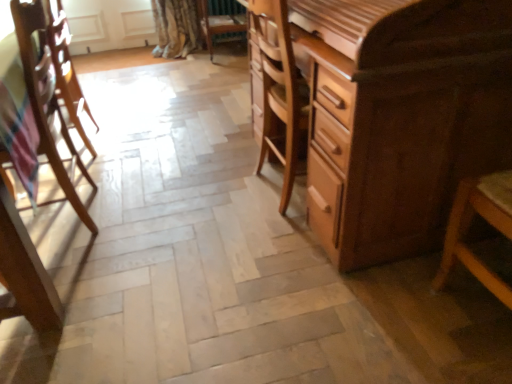
Question: Should I look upward or downward to see shiny brown wooden chest of drawers at right?

Choices:
 (A) down
 (B) up

Answer: (B)

Question: From the image's perspective, is wooden chair at center, positioned as the first chair in back-to-front order, under shiny brown wooden chest of drawers at right?

Choices:
 (A) no
 (B) yes

Answer: (A)

Question: From a real-world perspective, is wooden chair at center, placed as the 1th chair when sorted from right to left, physically below shiny brown wooden chest of drawers at right?

Choices:
 (A) yes
 (B) no

Answer: (A)

Question: Is the depth of wooden chair at center, placed as the 1th chair when sorted from right to left, greater than that of shiny brown wooden chest of drawers at right?

Choices:
 (A) no
 (B) yes

Answer: (B)

Question: Would you say wooden chair at center, the first chair when ordered from top to bottom, contains shiny brown wooden chest of drawers at right?

Choices:
 (A) no
 (B) yes

Answer: (A)

Question: Is wooden chair at center, which appears as the second chair when viewed from the left, outside shiny brown wooden chest of drawers at right?

Choices:
 (A) yes
 (B) no

Answer: (A)

Question: Can you confirm if wooden chair at center, positioned as the first chair in back-to-front order, is positioned to the right of shiny brown wooden chest of drawers at right?

Choices:
 (A) yes
 (B) no

Answer: (B)

Question: Considering the relative sizes of wooden chair at left, placed as the second chair when sorted from right to left, and shiny brown wooden chest of drawers at right in the image provided, is wooden chair at left, placed as the second chair when sorted from right to left, taller than shiny brown wooden chest of drawers at right?

Choices:
 (A) yes
 (B) no

Answer: (B)

Question: Is wooden chair at left, which is the 1th chair in bottom-to-top order, wider than shiny brown wooden chest of drawers at right?

Choices:
 (A) no
 (B) yes

Answer: (A)

Question: Is there a large distance between wooden chair at left, the 2th chair viewed from the top, and shiny brown wooden chest of drawers at right?

Choices:
 (A) yes
 (B) no

Answer: (A)

Question: Considering the relative positions of wooden chair at left, which is the second chair in back-to-front order, and shiny brown wooden chest of drawers at right in the image provided, is wooden chair at left, which is the second chair in back-to-front order, to the right of shiny brown wooden chest of drawers at right from the viewer's perspective?

Choices:
 (A) yes
 (B) no

Answer: (B)

Question: From the image's perspective, does wooden chair at left, the first chair in the left-to-right sequence, appear higher than shiny brown wooden chest of drawers at right?

Choices:
 (A) no
 (B) yes

Answer: (A)

Question: From a real-world perspective, is wooden chair at left, placed as the second chair when sorted from right to left, located higher than shiny brown wooden chest of drawers at right?

Choices:
 (A) no
 (B) yes

Answer: (A)

Question: Can you confirm if wooden chair at left, the 2th chair viewed from the top, is shorter than wooden chair at center, positioned as the first chair in back-to-front order?

Choices:
 (A) no
 (B) yes

Answer: (A)